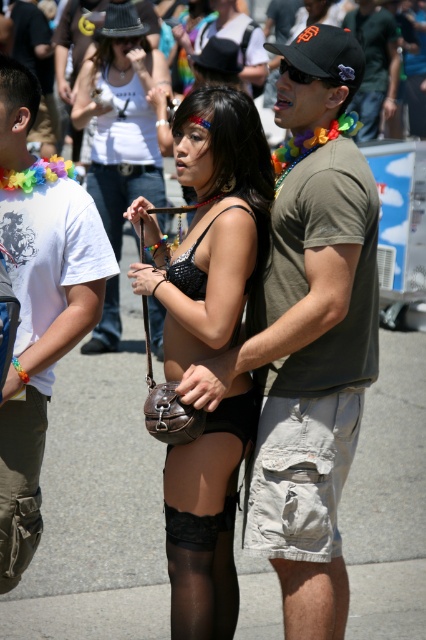
Question: Among these objects, which one is farthest from the camera?

Choices:
 (A) matte olive green t-shirt at center
 (B) matte black cap at upper center
 (C) white cotton t-shirt at left

Answer: (B)

Question: Which of the following is the closest to the observer?

Choices:
 (A) matte olive green t-shirt at center
 (B) white cotton t-shirt at left

Answer: (B)

Question: Is matte olive green t-shirt at center to the right of tan fabric shorts at lower right from the viewer's perspective?

Choices:
 (A) yes
 (B) no

Answer: (B)

Question: Among these points, which one is farthest from the camera?

Choices:
 (A) click(391, 72)
 (B) click(317, 458)
 (C) click(321, 29)

Answer: (A)

Question: Does leather purse at center appear on the left side of tan fabric shorts at lower right?

Choices:
 (A) yes
 (B) no

Answer: (A)

Question: Is leather bra at center to the left of matte black cap at upper center from the viewer's perspective?

Choices:
 (A) yes
 (B) no

Answer: (A)